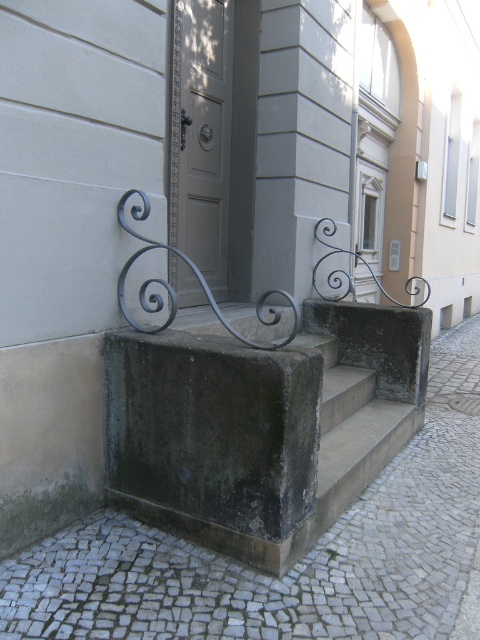
You are standing at the base of the steps leading to the door in the image. There is a gray concrete pavement at lower center located at point (296, 564). If you want to walk straight towards the door, will you step onto the gray concrete pavement at lower center before reaching the first step?

The gray concrete pavement at lower center is located at point (296, 564), which is before the first step. Therefore, yes, you will step onto the gray concrete pavement at lower center before reaching the first step.

You are a delivery person standing on the gray concrete pavement at lower center and need to reach the matte gray door at center. Can you walk directly to the door without stepping off the pavement?

The gray concrete pavement at lower center is positioned under the matte gray door at center, meaning the pavement leads directly to the door. Yes, you can walk directly to the matte gray door at center without stepping off the pavement.